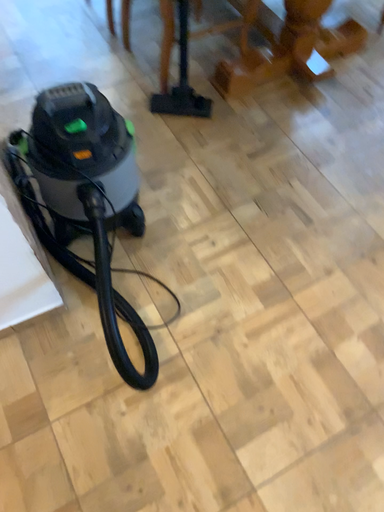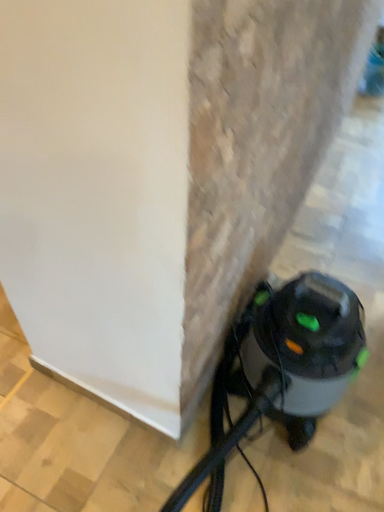
Question: Which way did the camera rotate in the video?

Choices:
 (A) rotated right
 (B) rotated left

Answer: (B)